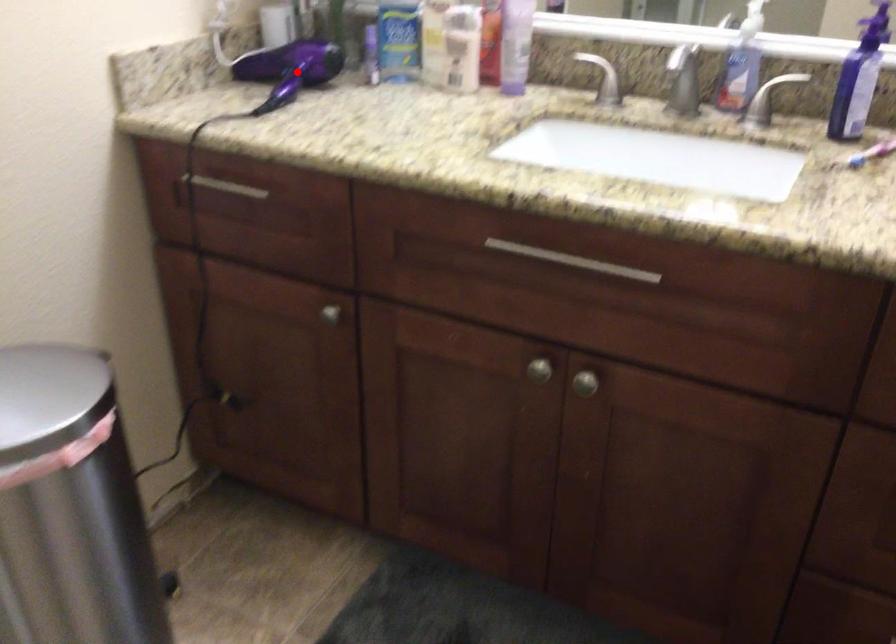
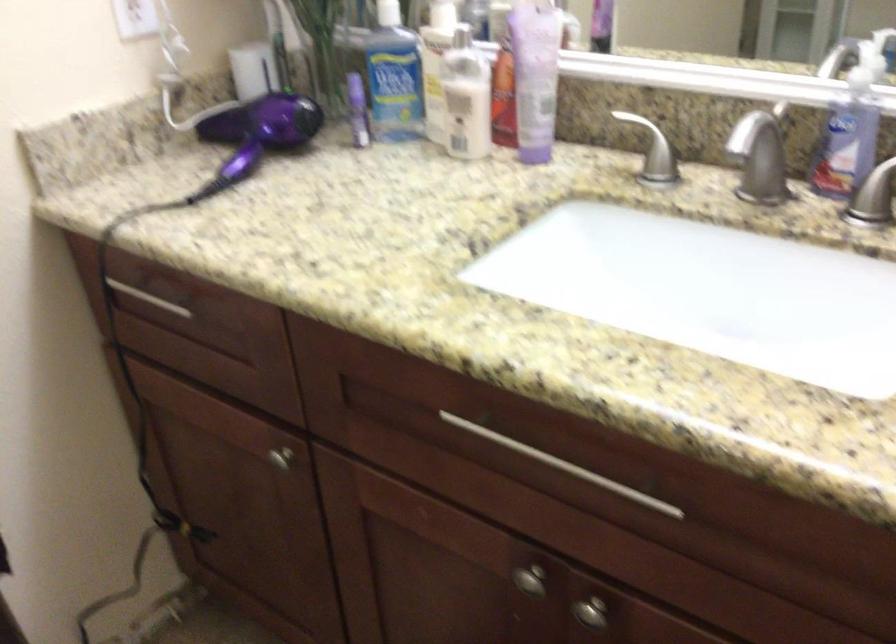
Question: I am providing you with two images of the same scene from different viewpoints. A red point is marked on the first image. At the location where the point appears in image 1, is it still visible in image 2?

Choices:
 (A) Yes
 (B) No

Answer: (A)